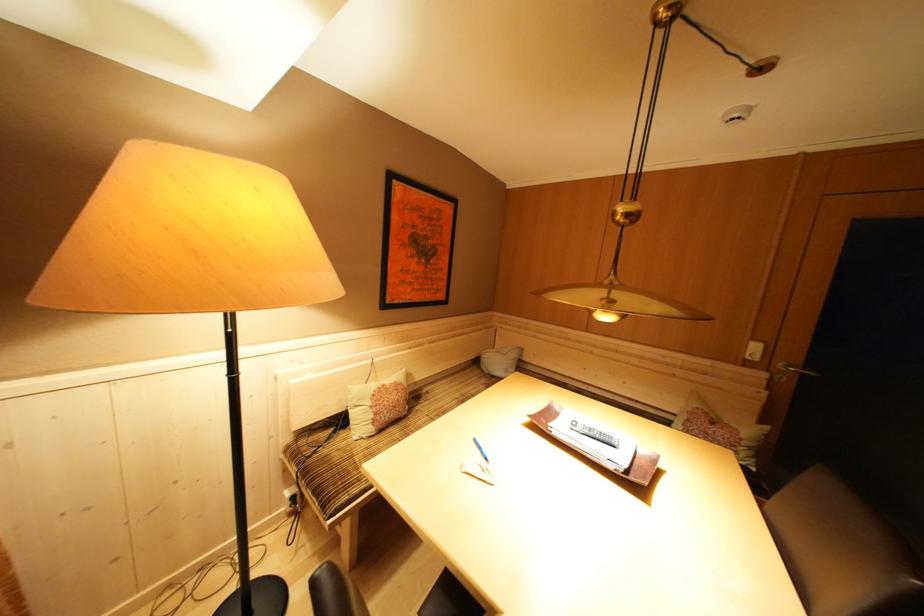
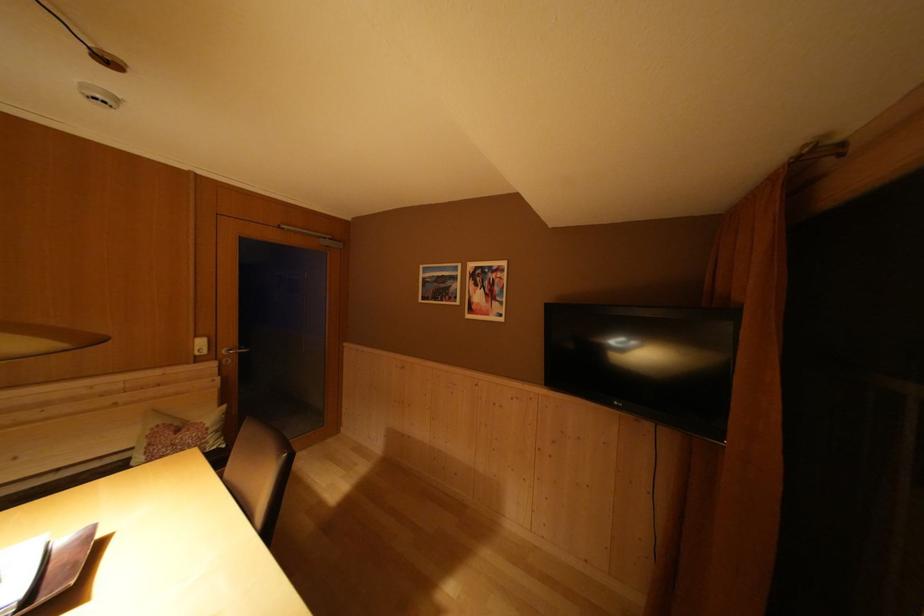
Question: The camera is either moving clockwise (left) or counter-clockwise (right) around the object. The first image is from the beginning of the video and the second image is from the end. Is the camera moving left or right when shooting the video?

Choices:
 (A) Left
 (B) Right

Answer: (A)